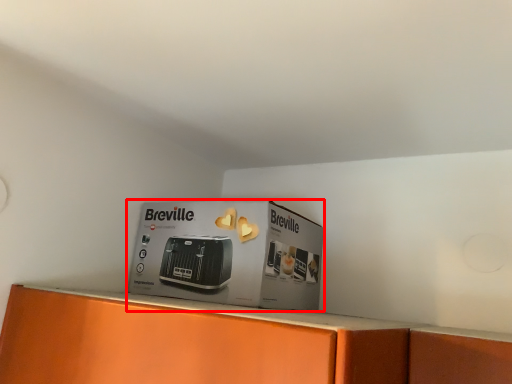
Question: From the image's perspective, where is cardboard box (annotated by the red box) located relative to home appliance?

Choices:
 (A) below
 (B) above

Answer: (B)